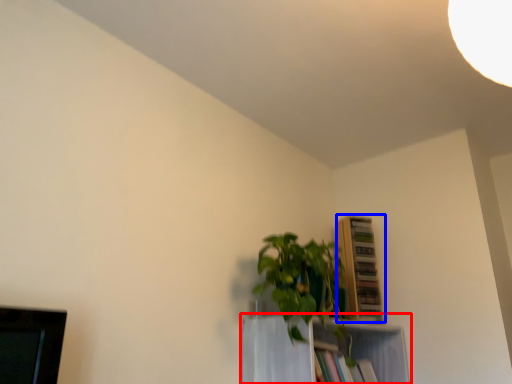
Question: Which object appears farthest to the camera in this image, shelf (highlighted by a red box) or shelf (highlighted by a blue box)?

Choices:
 (A) shelf
 (B) shelf

Answer: (B)